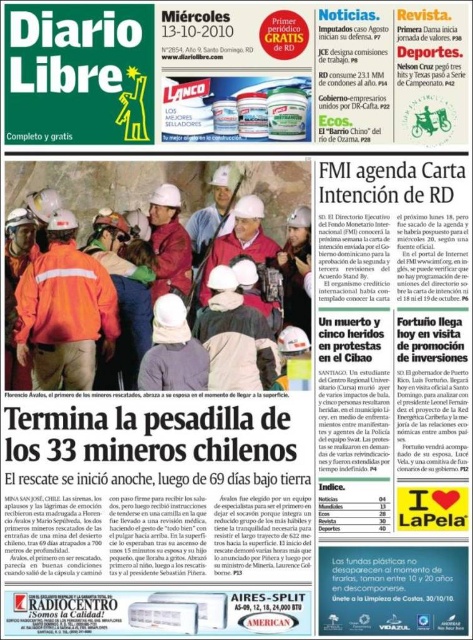
Question: Is the position of orange reflective jacket at center less distant than that of reddish-brown fabric hard hat at center?

Choices:
 (A) yes
 (B) no

Answer: (A)

Question: Among these objects, which one is farthest from the camera?

Choices:
 (A) orange fabric safety vest at center
 (B) orange reflective jacket at center

Answer: (A)

Question: Is orange fabric safety vest at center positioned behind reddish-brown fabric hard hat at center?

Choices:
 (A) no
 (B) yes

Answer: (A)

Question: Which object is farther from the camera taking this photo?

Choices:
 (A) orange reflective jacket at center
 (B) orange fabric safety vest at center

Answer: (B)

Question: Is orange reflective jacket at center wider than reddish-brown fabric hard hat at center?

Choices:
 (A) no
 (B) yes

Answer: (B)

Question: Which object is positioned closest to the orange fabric safety vest at center?

Choices:
 (A) orange reflective jacket at center
 (B) reddish-brown fabric hard hat at center

Answer: (A)